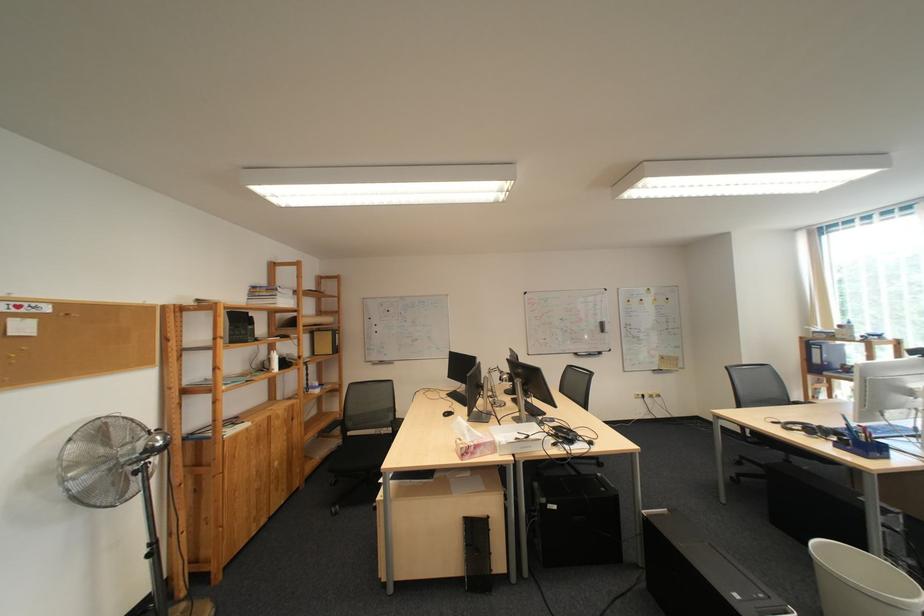
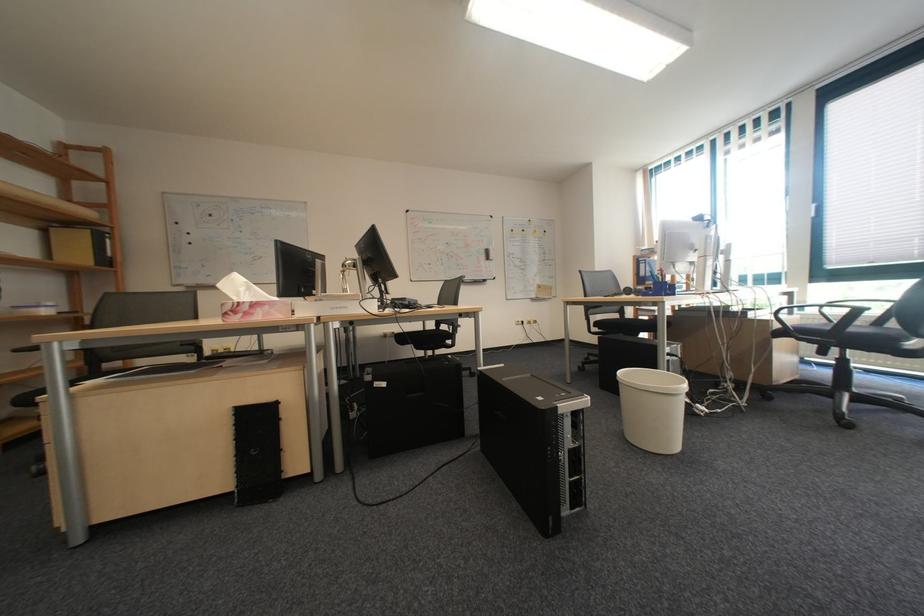
Locate, in the second image, the point that corresponds to [492,451] in the first image.

(273, 312)